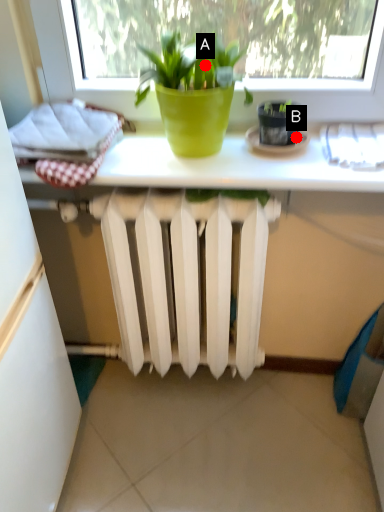
Question: Two points are circled on the image, labeled by A and B beside each circle. Among these points, which one is farthest from the camera?

Choices:
 (A) A is further
 (B) B is further

Answer: (B)